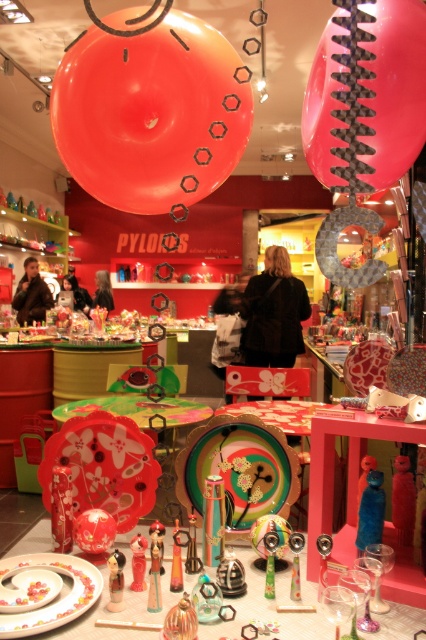
Can you confirm if blue glossy toy at center is positioned to the left of blue plastic toy at center?

Correct, you'll find blue glossy toy at center to the left of blue plastic toy at center.

Who is shorter, blue glossy toy at center or blue plastic toy at center?

blue plastic toy at center is shorter.

Who is more forward, (380, 525) or (362, 460)?

Point (380, 525) is in front.

Where is `blue glossy toy at center`? The height and width of the screenshot is (640, 426). blue glossy toy at center is located at coordinates (371, 513).

Can you confirm if matte orange balloon at upper center is wider than blue glossy toy at center?

Indeed, matte orange balloon at upper center has a greater width compared to blue glossy toy at center.

Measure the distance between matte orange balloon at upper center and blue glossy toy at center.

The distance of matte orange balloon at upper center from blue glossy toy at center is 38.06 inches.

Between point (164, 195) and point (356, 545), which one is positioned in front?

Point (356, 545)

Locate an element on the screen. The width and height of the screenshot is (426, 640). matte orange balloon at upper center is located at coordinates (150, 109).

Who is positioned more to the right, pink matte balloon at upper center or translucent plastic figurine at center?

From the viewer's perspective, pink matte balloon at upper center appears more on the right side.

Is pink matte balloon at upper center to the left of translucent plastic figurine at center from the viewer's perspective?

In fact, pink matte balloon at upper center is to the right of translucent plastic figurine at center.

Does point (354, 157) come in front of point (161, 529)?

Yes, it is in front of point (161, 529).

Locate an element on the screen. pink matte balloon at upper center is located at coordinates (367, 93).